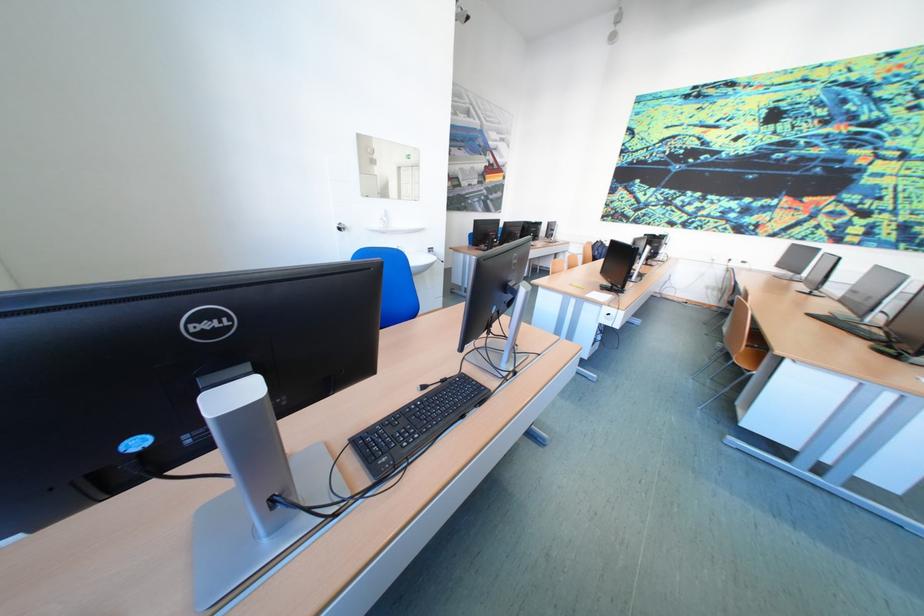
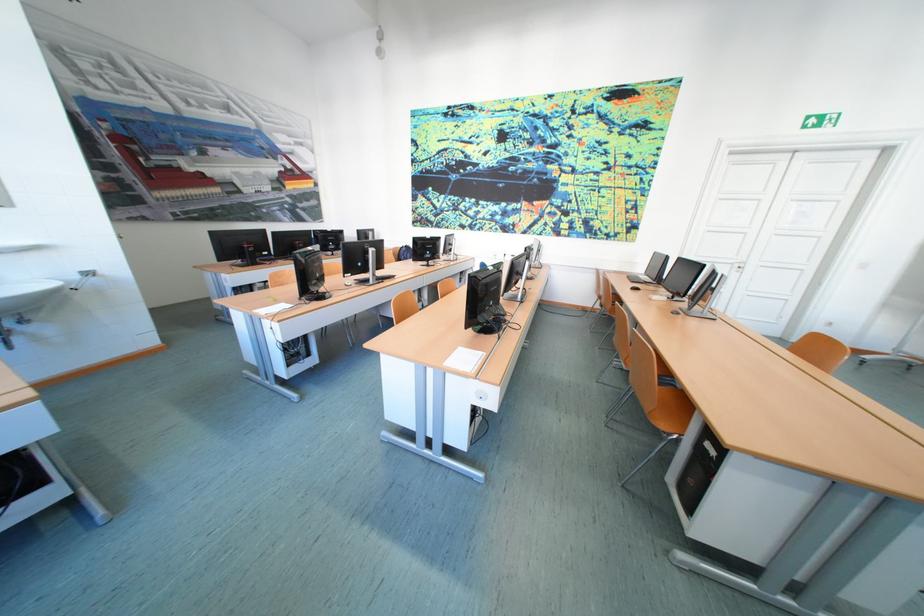
Question: Which direction would the cameraman need to move to produce the second image? Reply with the corresponding letter.

Choices:
 (A) Left
 (B) Right
 (C) Forward
 (D) Backward

Answer: (B)